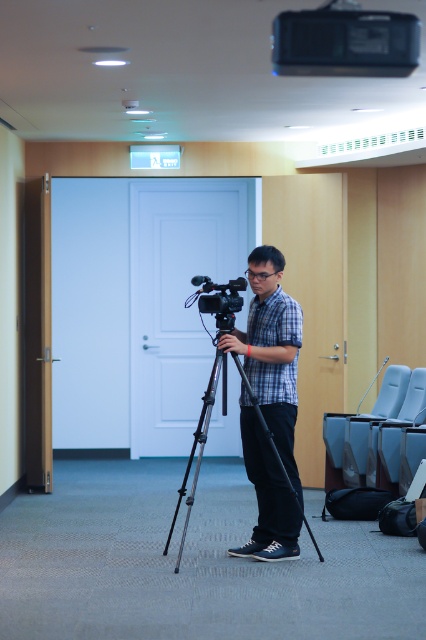
Between black metal tripod at center and matte black camera at center, which one has more height?

With more height is black metal tripod at center.

Does black metal tripod at center appear over matte black camera at center?

Incorrect, black metal tripod at center is not positioned above matte black camera at center.

Locate an element on the screen. This screenshot has height=640, width=426. black metal tripod at center is located at coordinates (199, 444).

Image resolution: width=426 pixels, height=640 pixels. Identify the location of black metal tripod at center. (199, 444).

Is black plastic projector at upper center smaller than matte black camera at center?

Yes.

Which is in front, point (362, 60) or point (227, 305)?

Positioned in front is point (362, 60).

At what (x,y) coordinates should I click in order to perform the action: click on black plastic projector at upper center. Please return your answer as a coordinate pair (x, y). The image size is (426, 640). Looking at the image, I should click on (345, 42).

Which is below, plaid shirt at center or black plastic projector at upper center?

Positioned lower is plaid shirt at center.

Is plaid shirt at center closer to camera compared to black plastic projector at upper center?

No, plaid shirt at center is further to the viewer.

Is point (284, 484) farther from viewer compared to point (356, 49)?

Yes, it is behind point (356, 49).

This screenshot has height=640, width=426. I want to click on plaid shirt at center, so click(x=271, y=349).